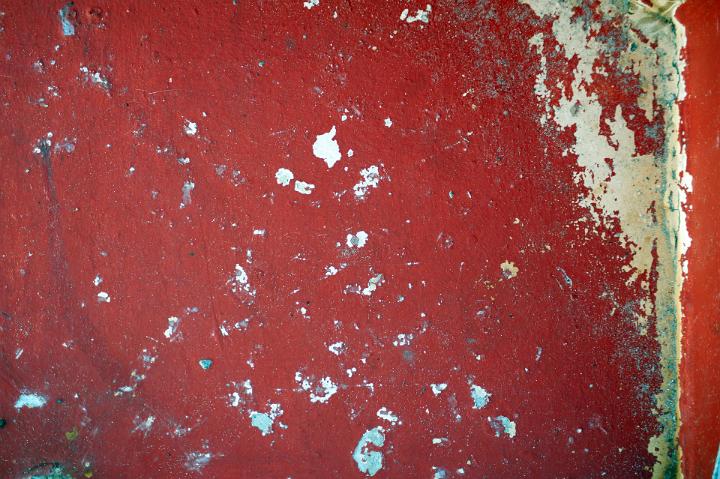
The image size is (720, 479). In order to click on paint peeling in this screenshot , I will do `click(615, 190)`.